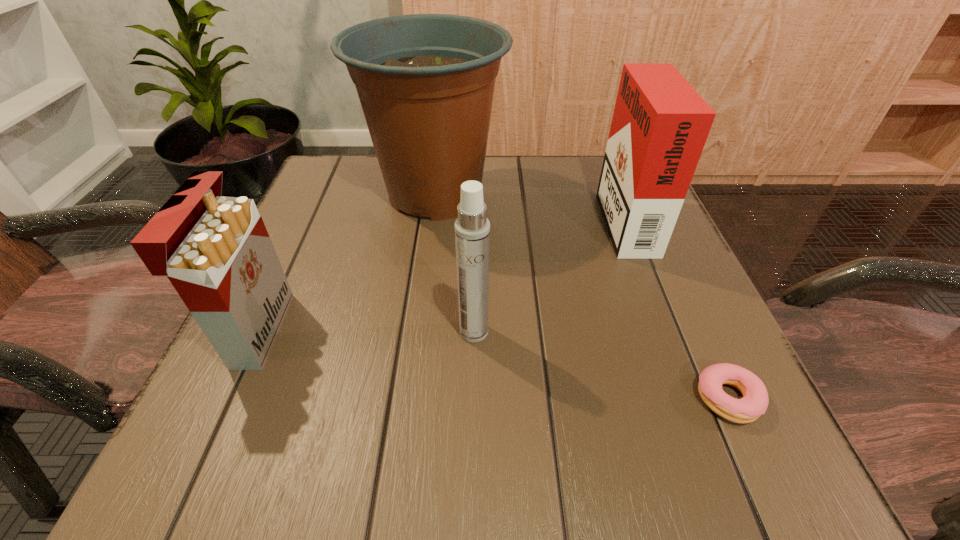
Identify the location of vacant space located on the front-facing side of the farther cigarette case. The image size is (960, 540). (532, 217).

In order to click on free space located 0.120m on the right of the aerosol can in this screenshot , I will do [x=564, y=332].

Locate an element on the screen. The image size is (960, 540). vacant area situated 0.370m with the lid open on the shorter cigarette case is located at coordinates (512, 330).

Identify the location of vacant space located 0.330m on the back of the shortest object. (652, 232).

Image resolution: width=960 pixels, height=540 pixels. I want to click on flowerpot that is positioned at the far edge, so click(425, 82).

The height and width of the screenshot is (540, 960). Identify the location of cigarette case that is at the far edge. (660, 124).

At what (x,y) coordinates should I click in order to perform the action: click on object that is at the near edge. Please return your answer as a coordinate pair (x, y). The image size is (960, 540). Looking at the image, I should click on (754, 403).

The image size is (960, 540). In order to click on flowerpot positioned at the left edge in this screenshot , I will do `click(425, 82)`.

Identify the location of cigarette case that is at the left edge. The width and height of the screenshot is (960, 540). (215, 250).

Locate an element on the screen. Image resolution: width=960 pixels, height=540 pixels. cigarette case that is at the right edge is located at coordinates (660, 124).